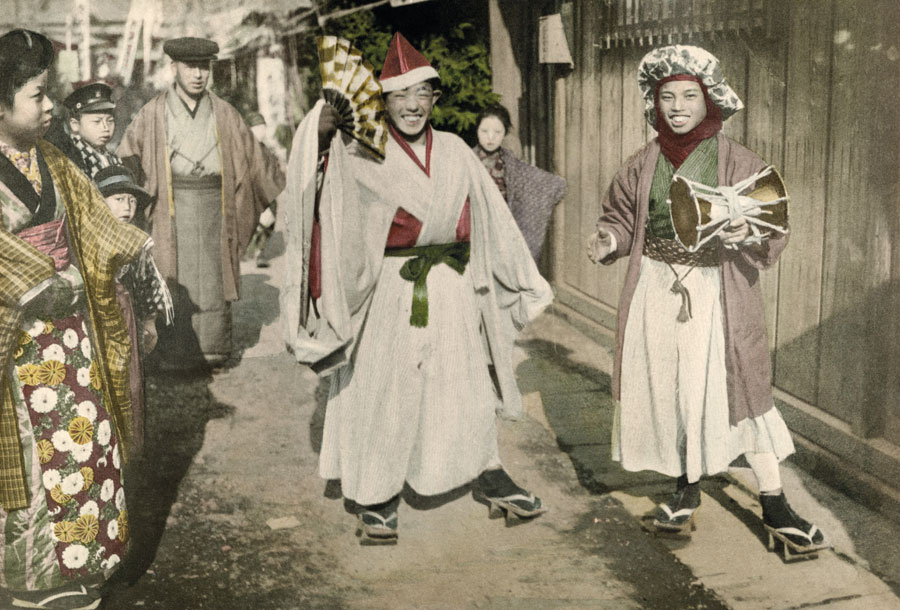
This screenshot has height=610, width=900. Find the location of `plant`. plant is located at coordinates (466, 65).